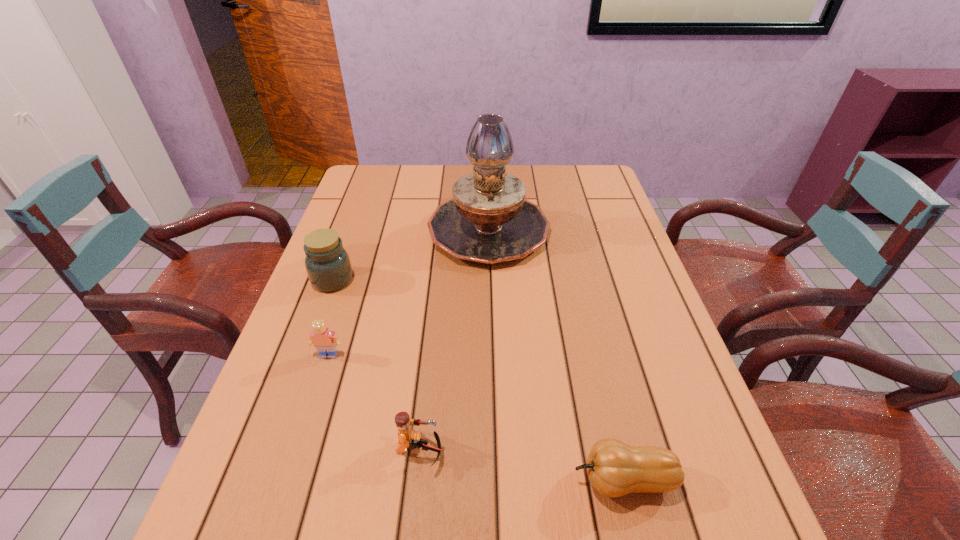
At what (x,y) coordinates should I click in order to perform the action: click on oil lamp. Please return your answer as a coordinate pair (x, y). The height and width of the screenshot is (540, 960). Looking at the image, I should click on pos(488,220).

Identify the location of jar. The image size is (960, 540). (327, 263).

You are a GUI agent. You are given a task and a screenshot of the screen. Output one action in this format:
    pyautogui.click(x=<x>, y=<y>)
    Task: Click on the third farthest object
    This screenshot has height=540, width=960.
    Given the screenshot: What is the action you would take?
    pyautogui.click(x=322, y=338)

Locate an element on the screen. This screenshot has width=960, height=540. the left Lego is located at coordinates (322, 338).

Where is `the right Lego`? the right Lego is located at coordinates (409, 439).

I want to click on gourd, so click(x=614, y=468).

Image resolution: width=960 pixels, height=540 pixels. I want to click on vacant space situated on the right of the oil lamp, so click(588, 228).

I want to click on free space located 0.290m on the back of the jar, so (359, 207).

Locate an element on the screen. vacant space situated 0.340m on the front-facing side of the left Lego is located at coordinates (273, 529).

Identify the location of free point located 0.210m holding a crossbow in the hands of the right Lego. (558, 450).